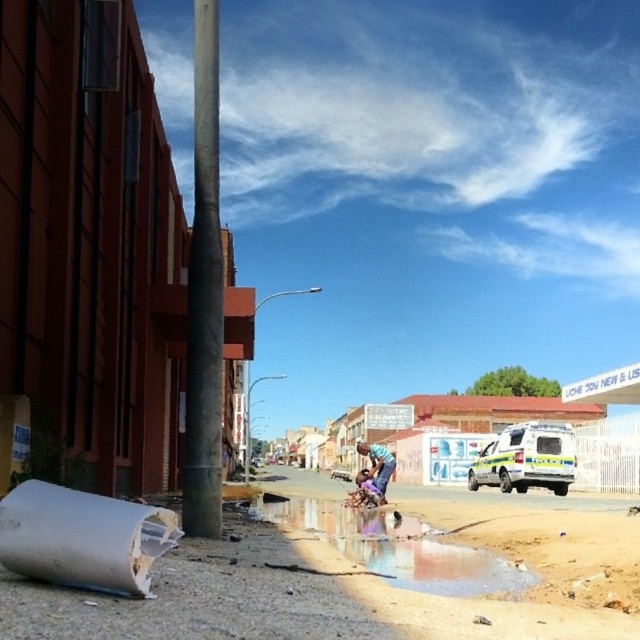
Is reflective wet surface at lower center smaller than blue jeans at center?

Indeed, reflective wet surface at lower center has a smaller size compared to blue jeans at center.

Which is above, reflective wet surface at lower center or blue jeans at center?

Positioned higher is reflective wet surface at lower center.

What do you see at coordinates (394, 547) in the screenshot?
I see `reflective wet surface at lower center` at bounding box center [394, 547].

Find the location of a particular element. The height and width of the screenshot is (640, 640). reflective wet surface at lower center is located at coordinates (394, 547).

Does smooth concrete pole at left appear on the right side of blue jeans at center?

No, smooth concrete pole at left is not to the right of blue jeans at center.

What do you see at coordinates (204, 294) in the screenshot?
I see `smooth concrete pole at left` at bounding box center [204, 294].

Does point (198, 120) lie in front of point (381, 500)?

Yes, point (198, 120) is in front of point (381, 500).

The height and width of the screenshot is (640, 640). In order to click on smooth concrete pole at left in this screenshot , I will do `click(204, 294)`.

Does smooth concrete pole at left have a lesser width compared to yellow-green plastic ambulance at center-right?

Incorrect, smooth concrete pole at left's width is not less than yellow-green plastic ambulance at center-right's.

Between smooth concrete pole at left and yellow-green plastic ambulance at center-right, which one is positioned higher?

smooth concrete pole at left is higher up.

Between point (196, 289) and point (493, 468), which one is positioned in front?

Point (196, 289) is more forward.

This screenshot has width=640, height=640. Find the location of `smooth concrete pole at left`. smooth concrete pole at left is located at coordinates (204, 294).